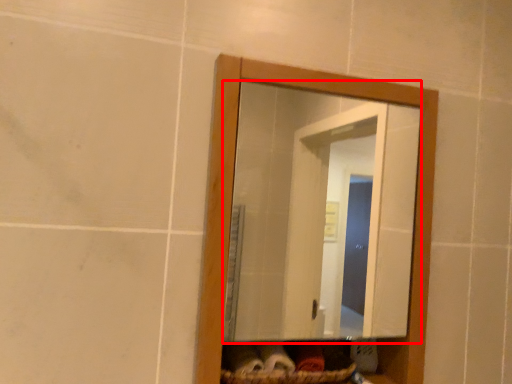
Question: From the image's perspective, what is the correct spatial relationship of mirror (annotated by the red box) in relation to basket?

Choices:
 (A) below
 (B) above

Answer: (B)